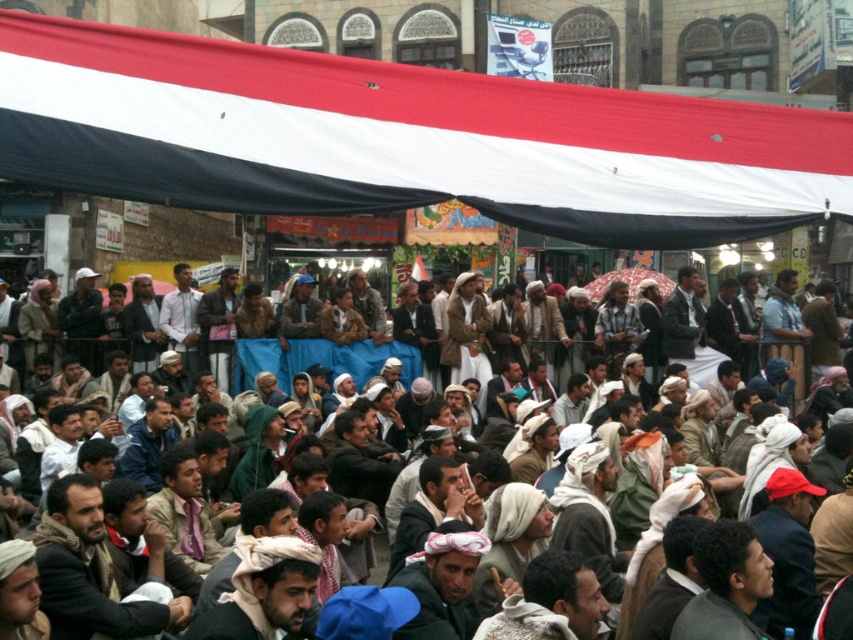
Who is positioned more to the left, red-white-black fabric at upper center or brown textured clothing at lower center?

red-white-black fabric at upper center

Can you confirm if red-white-black fabric at upper center is bigger than brown textured clothing at lower center?

No, red-white-black fabric at upper center is not bigger than brown textured clothing at lower center.

Where is `red-white-black fabric at upper center`? The height and width of the screenshot is (640, 853). red-white-black fabric at upper center is located at coordinates (401, 138).